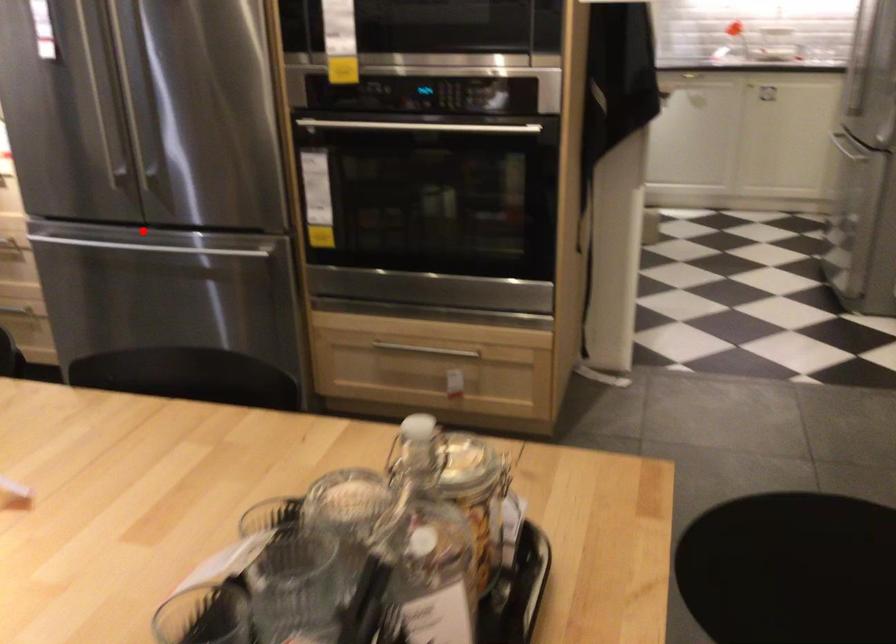
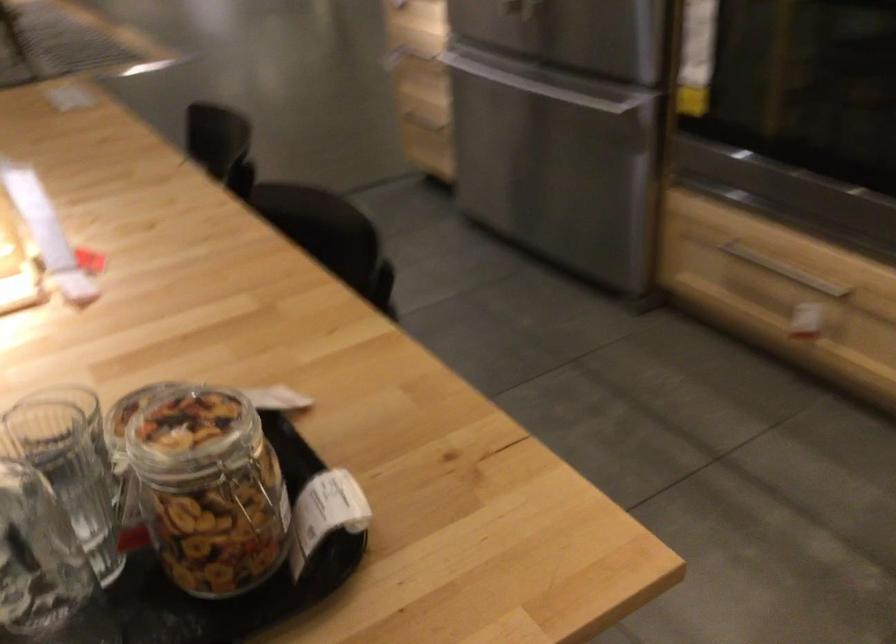
The point at the highlighted location is marked in the first image. Where is the corresponding point in the second image?

(523, 68)